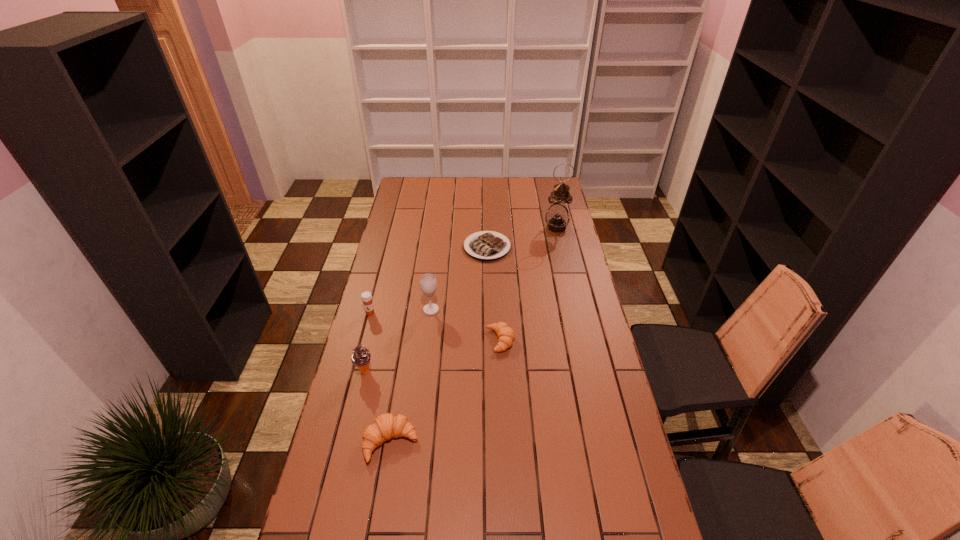
Identify the location of free spot between the farther crescent roll and the fifth shortest object. (432, 356).

Where is `vacant space in between the shorter crescent roll and the fourth shortest object`? vacant space in between the shorter crescent roll and the fourth shortest object is located at coordinates (435, 327).

The height and width of the screenshot is (540, 960). Identify the location of free space between the left crescent roll and the rightmost object. (473, 335).

Identify the location of vacant area that lies between the second shortest object and the nearer crescent roll. The width and height of the screenshot is (960, 540). (445, 392).

What are the coordinates of `vacant space that is in between the wineglass and the third nearest object` in the screenshot? It's located at (466, 325).

This screenshot has width=960, height=540. What are the coordinates of `unoccupied position between the shortest object and the sixth tallest object` in the screenshot? It's located at (493, 294).

Select which object appears as the third closest to the shorter crescent roll. Please provide its 2D coordinates. Your answer should be formatted as a tuple, i.e. [(x, y)], where the tuple contains the x and y coordinates of a point satisfying the conditions above.

[(484, 246)]

At what (x,y) coordinates should I click in order to perform the action: click on object that is the third closest to the sixth shortest object. Please return your answer as a coordinate pair (x, y). Looking at the image, I should click on (484, 246).

Where is `free location that satisfies the following two spatial constraints: 1. on the back side of the nearest object; 2. on the right side of the rightmost object`? The image size is (960, 540). free location that satisfies the following two spatial constraints: 1. on the back side of the nearest object; 2. on the right side of the rightmost object is located at coordinates (426, 227).

The height and width of the screenshot is (540, 960). Find the location of `free region that satisfies the following two spatial constraints: 1. on the label side of the fourth tallest object; 2. on the left side of the third nearest object`. free region that satisfies the following two spatial constraints: 1. on the label side of the fourth tallest object; 2. on the left side of the third nearest object is located at coordinates coord(363,340).